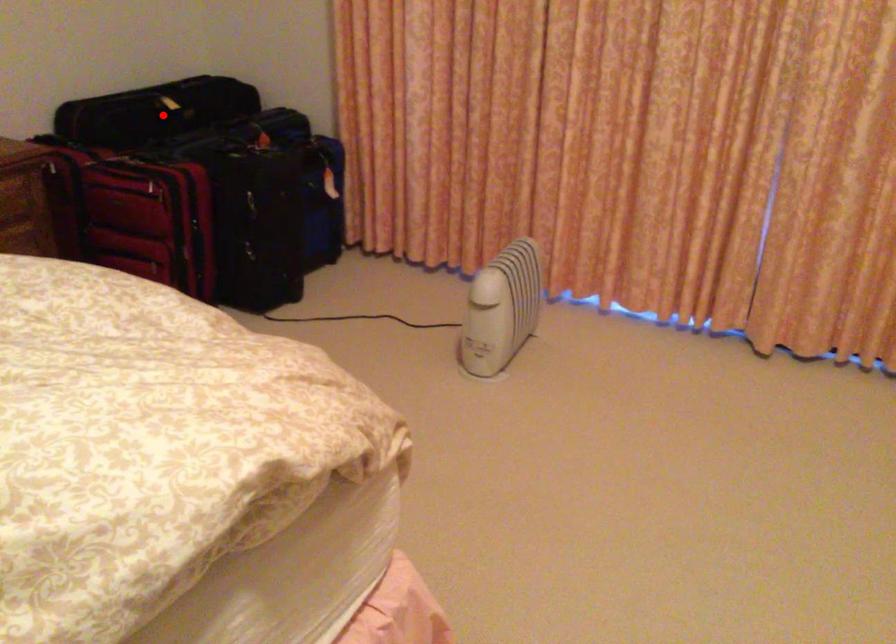
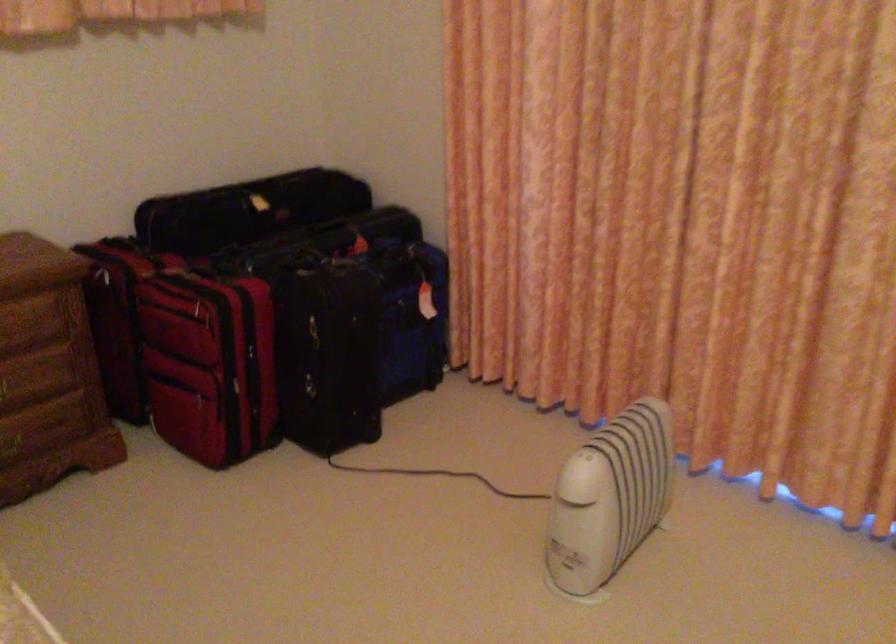
Question: I am providing you with two images of the same scene from different viewpoints. A red point is shown in image1. For the corresponding object point in image2, is it positioned nearer or farther from the camera?

Choices:
 (A) Nearer
 (B) Farther

Answer: (A)